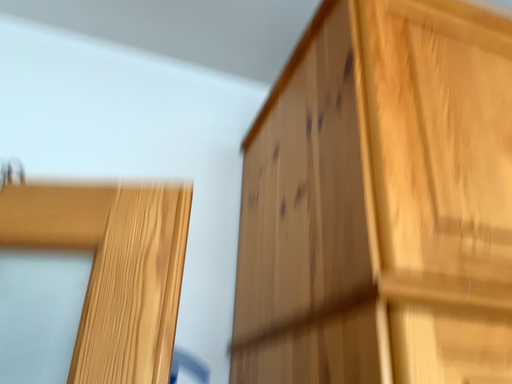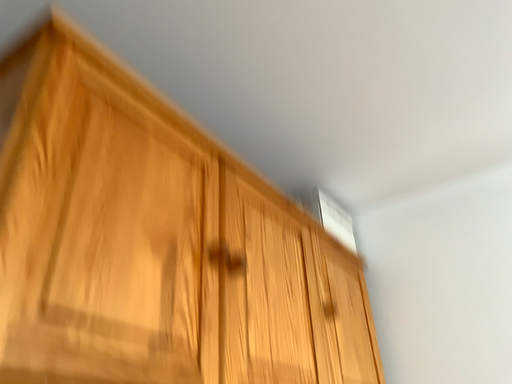
Question: Which way did the camera rotate in the video?

Choices:
 (A) rotated left
 (B) rotated right

Answer: (B)